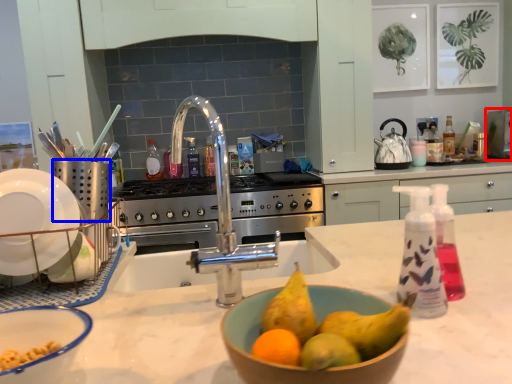
Question: Which object is closer to the camera taking this photo, appliance (highlighted by a red box) or appliance (highlighted by a blue box)?

Choices:
 (A) appliance
 (B) appliance

Answer: (B)